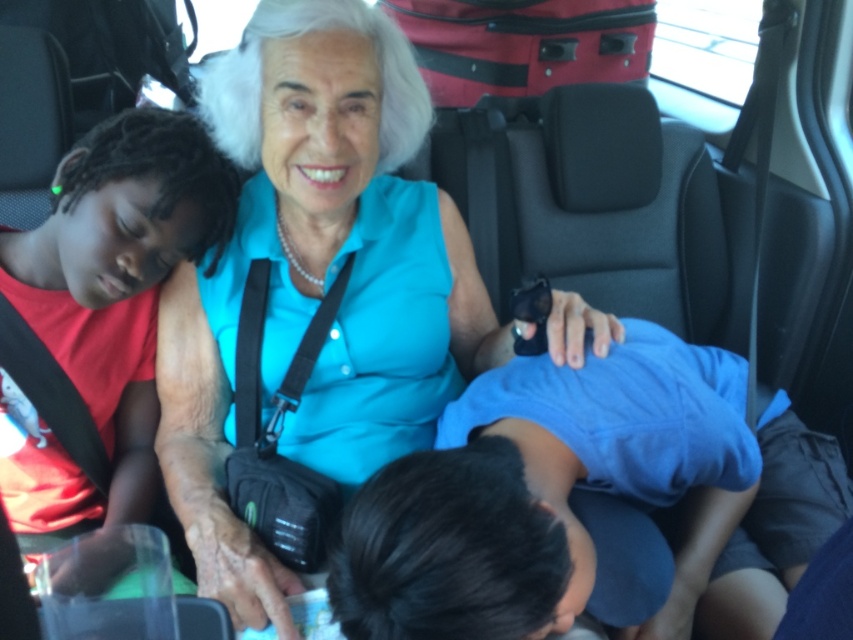
You are a delivery person trying to place a small package between the blue cotton shirt at center and the red fabric suitcase at upper center in the backseat. Can you fit the package there if it measures 1 meter in length?

The distance between the blue cotton shirt at center and the red fabric suitcase at upper center is 1.25 meters. Since the package is 1 meter long, there is enough space to fit it between them.

You are a photographer trying to capture a candid shot of the blue cotton shirt at center and the red fabric suitcase at upper center. Which object should you focus on first if you want to ensure both are in frame without moving the camera?

The blue cotton shirt at center is much taller than the red fabric suitcase at upper center, so focusing on the taller blue cotton shirt at center first will help ensure both are in frame without needing to adjust the camera angle.

You are a photographer trying to capture a closeup of the red cotton shirt at left and the red fabric suitcase at upper center. Which object should you zoom in on to ensure both are in focus without moving the camera?

The red cotton shirt at left is bigger than the red fabric suitcase at upper center, so you should zoom in on the red cotton shirt at left to ensure both are in focus without moving the camera.